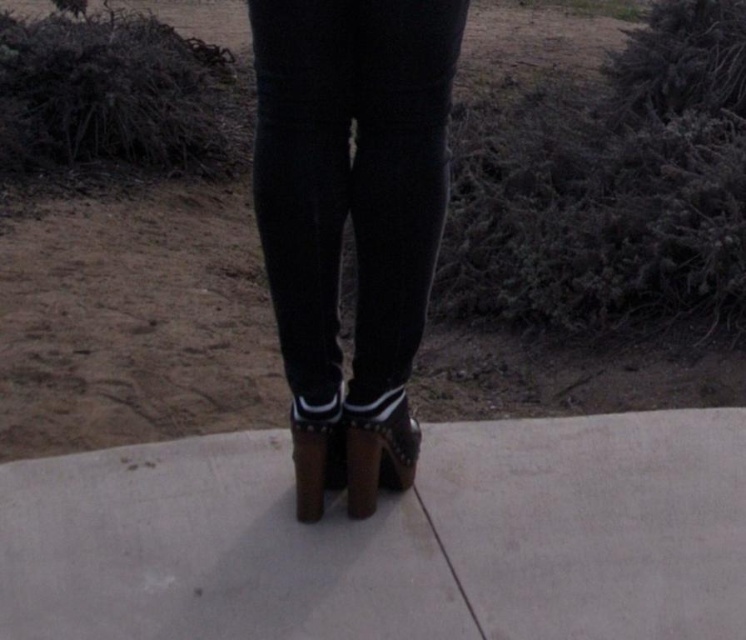
Does leather high-heeled sandal at center come in front of brown leather sandal at center?

That is False.

The height and width of the screenshot is (640, 746). Describe the element at coordinates (377, 449) in the screenshot. I see `leather high-heeled sandal at center` at that location.

Locate an element on the screen. Image resolution: width=746 pixels, height=640 pixels. leather high-heeled sandal at center is located at coordinates (377, 449).

The width and height of the screenshot is (746, 640). I want to click on black matte leggings at center, so click(351, 177).

Does black matte leggings at center have a smaller size compared to brown leather sandal at center?

Incorrect, black matte leggings at center is not smaller in size than brown leather sandal at center.

Who is more distant from viewer, [313,301] or [295,416]?

The point [295,416] is behind.

This screenshot has height=640, width=746. I want to click on black matte leggings at center, so click(x=351, y=177).

Between black matte leggings at center and leather high-heeled sandal at center, which one is positioned higher?

black matte leggings at center is above.

Which is more to the left, black matte leggings at center or leather high-heeled sandal at center?

black matte leggings at center

Between point (363, 266) and point (404, 456), which one is positioned in front?

Point (363, 266) is in front.

Locate an element on the screen. The image size is (746, 640). black matte leggings at center is located at coordinates (351, 177).